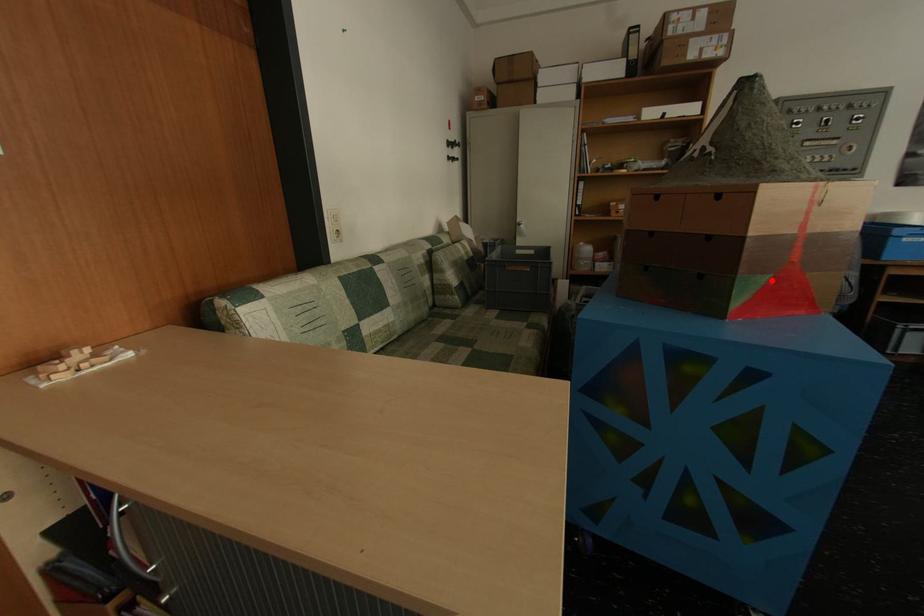
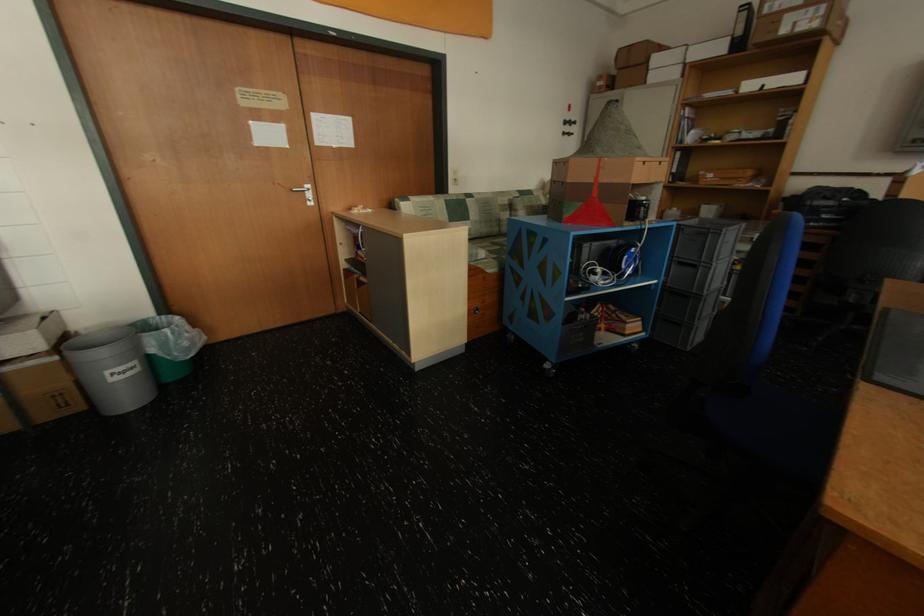
Find the pixel in the second image that matches the highlighted location in the first image.

(589, 206)